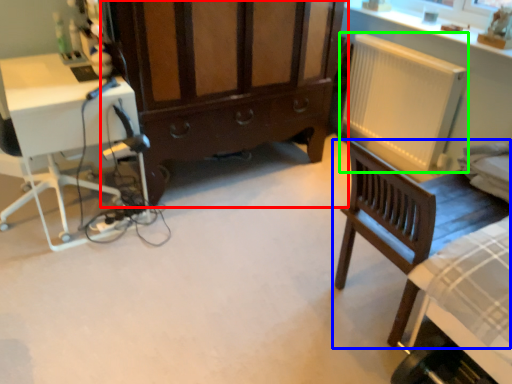
Question: Based on their relative distances, which object is farther from cabinetry (highlighted by a red box)? Choose from chair (highlighted by a blue box) and radiator (highlighted by a green box).

Choices:
 (A) chair
 (B) radiator

Answer: (A)